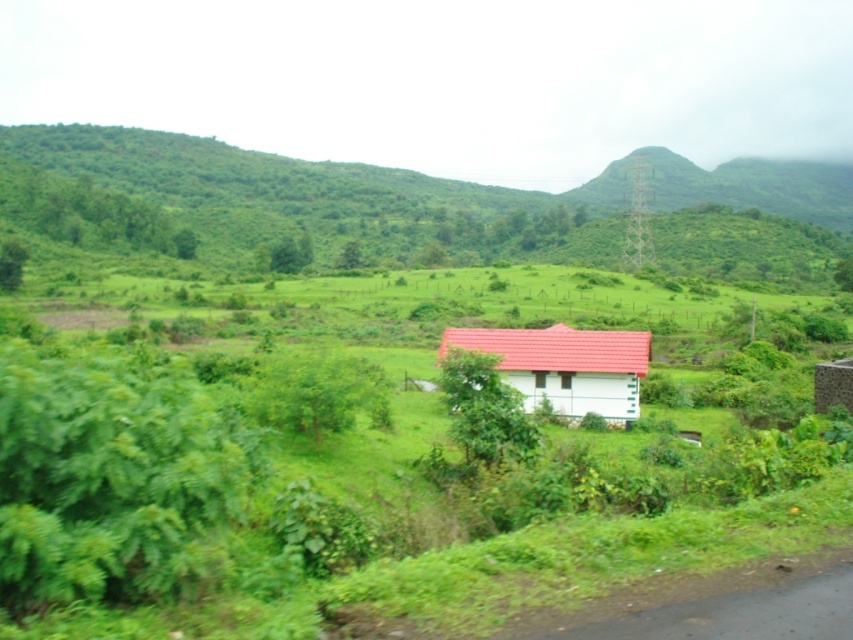
Is white matte house at center bigger than transparent glass train window at center?

Indeed, white matte house at center has a larger size compared to transparent glass train window at center.

How far apart are white matte house at center and transparent glass train window at center?

white matte house at center and transparent glass train window at center are 10.72 feet apart from each other.

Locate an element on the screen. white matte house at center is located at coordinates [566, 365].

Does point (569, 384) come farther from viewer compared to point (543, 387)?

No.

Describe the element at coordinates (566, 380) in the screenshot. I see `transparent glass window at center` at that location.

Where is `transparent glass window at center`? transparent glass window at center is located at coordinates (566, 380).

Can you confirm if white matte house at center is smaller than transparent glass window at center?

Incorrect, white matte house at center is not smaller in size than transparent glass window at center.

Between point (637, 349) and point (569, 387), which one is positioned behind?

Positioned behind is point (569, 387).

You are a GUI agent. You are given a task and a screenshot of the screen. Output one action in this format:
    pyautogui.click(x=<x>, y=<y>)
    Task: Click on the white matte house at center
    The width and height of the screenshot is (853, 640).
    Given the screenshot: What is the action you would take?
    pyautogui.click(x=566, y=365)

Locate an element on the screen. The image size is (853, 640). white matte house at center is located at coordinates (566, 365).